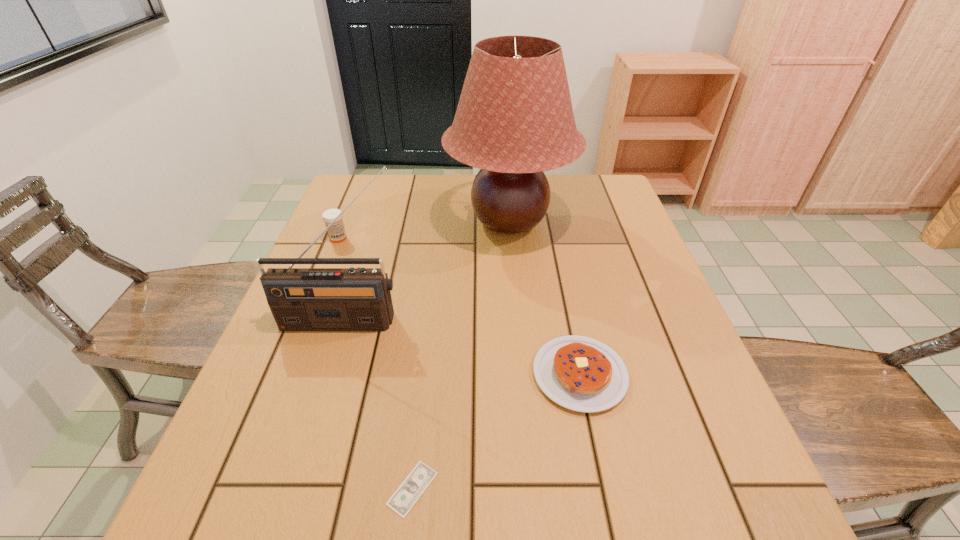
Where is `free space at the left edge`? Image resolution: width=960 pixels, height=540 pixels. free space at the left edge is located at coordinates (333, 333).

This screenshot has height=540, width=960. In order to click on free spot at the right edge of the desktop in this screenshot , I will do point(625,281).

I want to click on vacant position at the near left corner of the desktop, so click(x=234, y=517).

Identify the location of free space at the far right corner. The height and width of the screenshot is (540, 960). (605, 192).

The image size is (960, 540). What are the coordinates of `free space that is in between the shortest object and the third shortest object` in the screenshot? It's located at (375, 363).

Where is `free space between the third farthest object and the pancake`? free space between the third farthest object and the pancake is located at coordinates (461, 348).

The width and height of the screenshot is (960, 540). I want to click on empty space between the lampshade and the third shortest object, so click(423, 230).

What are the coordinates of `empty location between the shortest object and the lampshade` in the screenshot? It's located at (461, 355).

Identify the location of unoccupied position between the tallest object and the fourth shortest object. (426, 272).

Where is `free space between the money and the lampshade`? free space between the money and the lampshade is located at coordinates (461, 355).